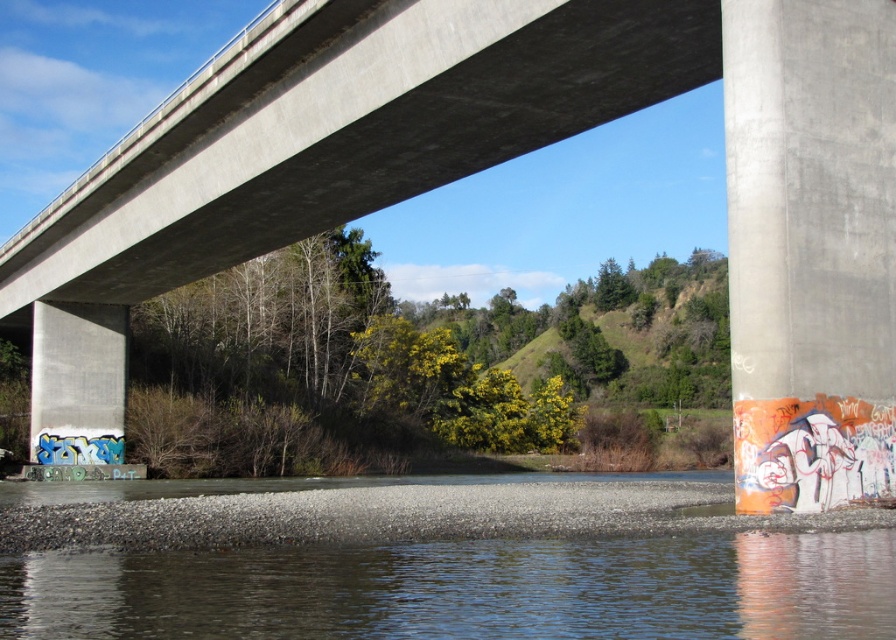
From the picture: Which of these two, clear water at bottom or concrete pillar at right, stands shorter?

Standing shorter between the two is clear water at bottom.

Between clear water at bottom and concrete pillar at right, which one has more height?

With more height is concrete pillar at right.

Who is more forward, (263,611) or (817,52)?

Point (263,611) is more forward.

Where is `clear water at bottom`? The height and width of the screenshot is (640, 896). clear water at bottom is located at coordinates (467, 589).

Which is in front, point (782, 323) or point (33, 419)?

Positioned in front is point (782, 323).

Describe the element at coordinates (810, 248) in the screenshot. I see `concrete pillar at right` at that location.

Image resolution: width=896 pixels, height=640 pixels. Identify the location of concrete pillar at right. (810, 248).

Is point (178, 557) in front of point (66, 369)?

That is True.

Consider the image. Measure the distance between point [302,636] and camera.

7.02 meters

Is point (841, 598) positioned behind point (35, 324)?

No, it is not.

This screenshot has height=640, width=896. Find the location of `clear water at bottom`. clear water at bottom is located at coordinates [467, 589].